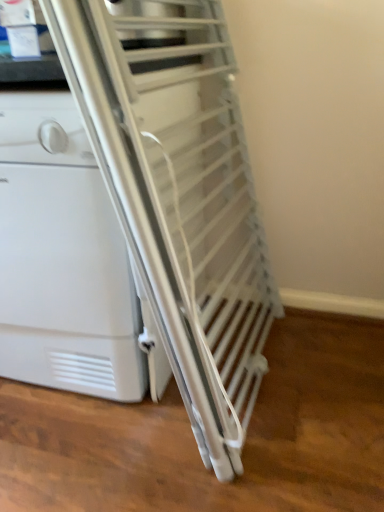
Locate an element on the screen. The image size is (384, 512). vacant space in front of white matte dishwasher at left is located at coordinates (110, 449).